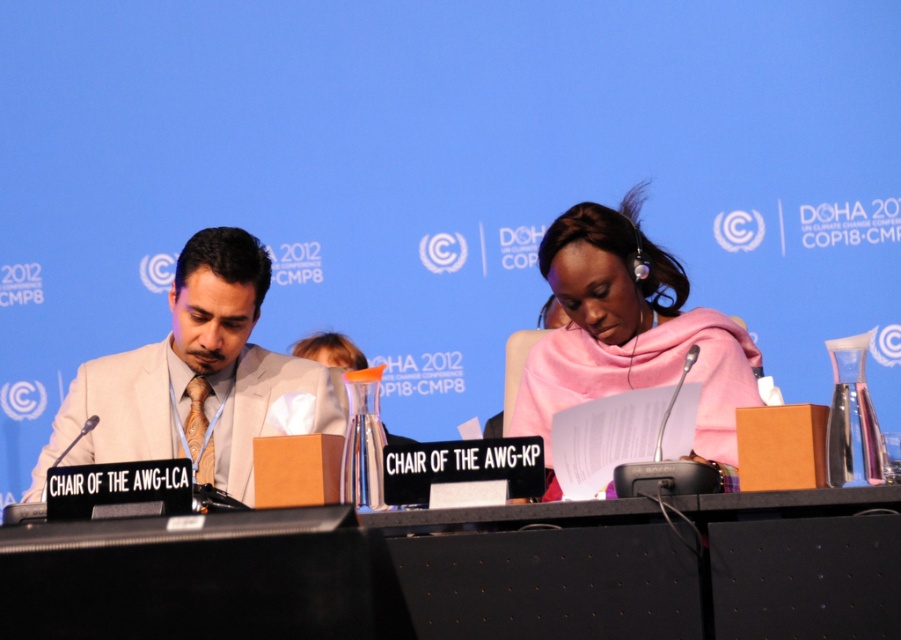
Question: Which object is closer to the camera taking this photo?

Choices:
 (A) black plastic table at center
 (B) white satin suit at center
 (C) pink fabric scarf at center

Answer: (A)

Question: Can you confirm if black plastic table at center is thinner than pink fabric scarf at center?

Choices:
 (A) yes
 (B) no

Answer: (B)

Question: Which object is closer to the camera taking this photo?

Choices:
 (A) black plastic table at center
 (B) pink fabric scarf at center

Answer: (A)

Question: Among these points, which one is nearest to the camera?

Choices:
 (A) (424, 568)
 (B) (666, 259)
 (C) (240, 384)

Answer: (A)

Question: Does white satin suit at center appear over pink fabric scarf at center?

Choices:
 (A) yes
 (B) no

Answer: (B)

Question: Is black plastic table at center below white satin suit at center?

Choices:
 (A) no
 (B) yes

Answer: (B)